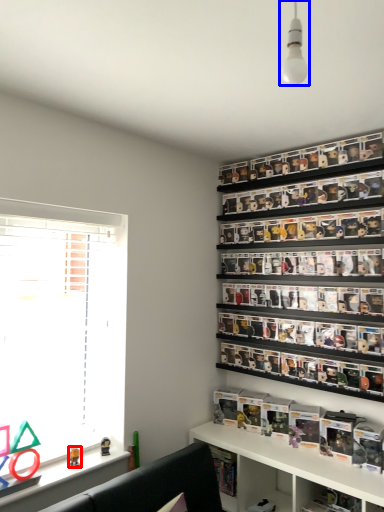
Question: Which object is further to the camera taking this photo, toy (highlighted by a red box) or light fixture (highlighted by a blue box)?

Choices:
 (A) toy
 (B) light fixture

Answer: (A)